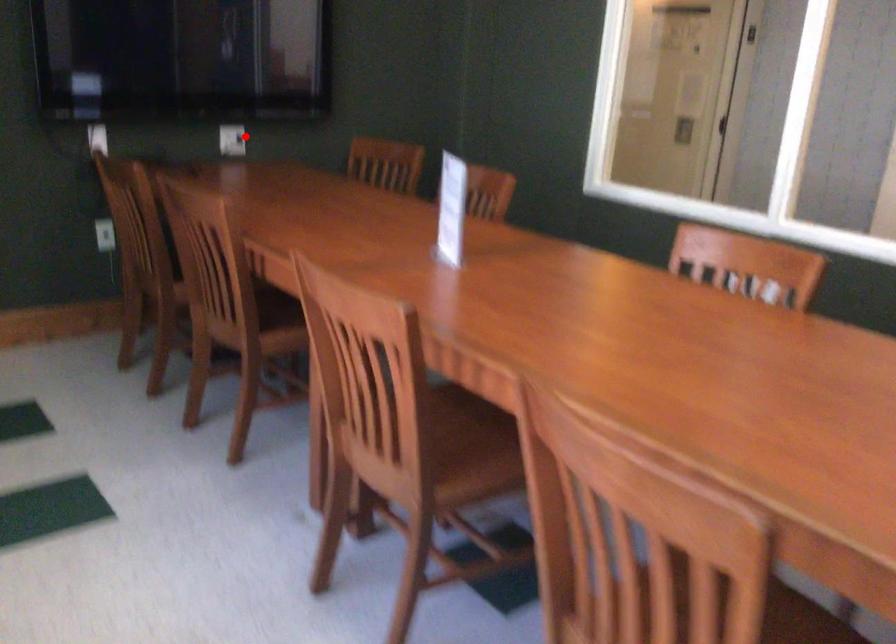
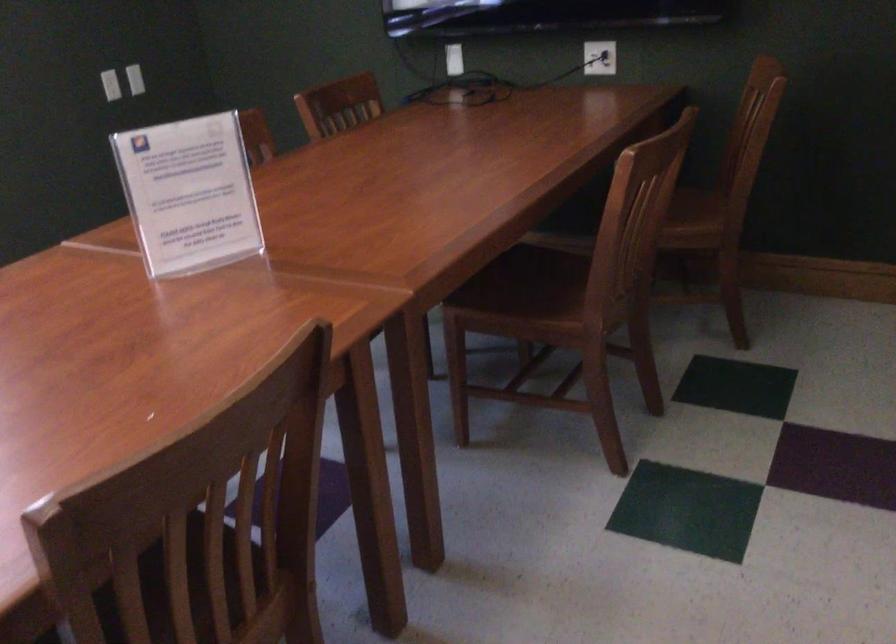
The point at the highlighted location is marked in the first image. Where is the corresponding point in the second image?

(599, 58)